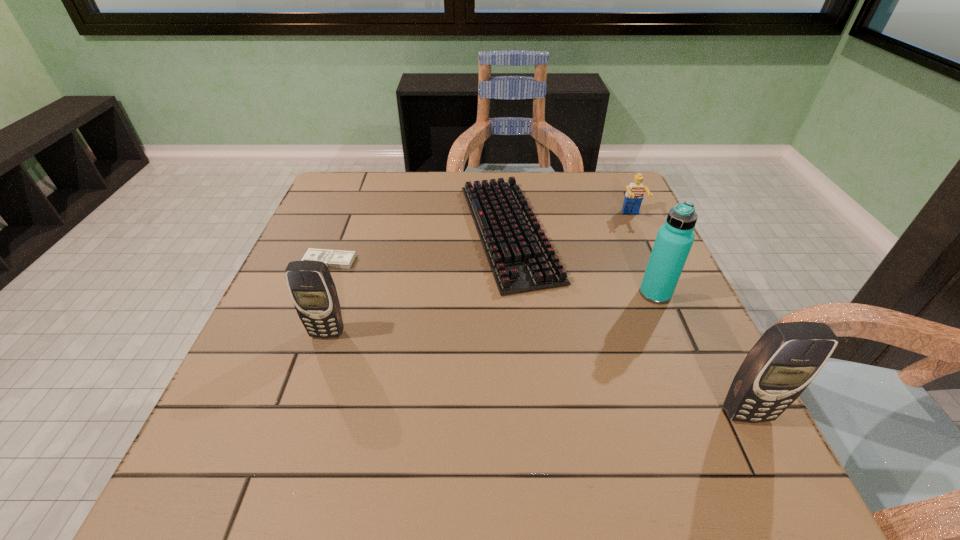
Where is `the shorter cellular telephone`? the shorter cellular telephone is located at coordinates (313, 292).

Image resolution: width=960 pixels, height=540 pixels. I want to click on the left cellular telephone, so click(x=313, y=292).

Where is `the taller cellular telephone`? The image size is (960, 540). the taller cellular telephone is located at coordinates (788, 356).

Locate an element on the screen. This screenshot has width=960, height=540. the nearer cellular telephone is located at coordinates click(x=788, y=356).

Locate an element on the screen. This screenshot has width=960, height=540. the third object from left to right is located at coordinates (521, 258).

Where is `computer keyboard`? The height and width of the screenshot is (540, 960). computer keyboard is located at coordinates (521, 258).

Identify the location of the third shortest object. This screenshot has width=960, height=540. (634, 195).

The width and height of the screenshot is (960, 540). I want to click on the shortest object, so click(x=332, y=258).

Where is `water bottle`? The width and height of the screenshot is (960, 540). water bottle is located at coordinates (674, 239).

You are a GUI agent. You are given a task and a screenshot of the screen. Output one action in this format:
    pyautogui.click(x=<x>, y=<y>)
    Task: Click on the vacant area located on the front face of the fifth farthest object
    
    Given the screenshot: What is the action you would take?
    pyautogui.click(x=304, y=402)